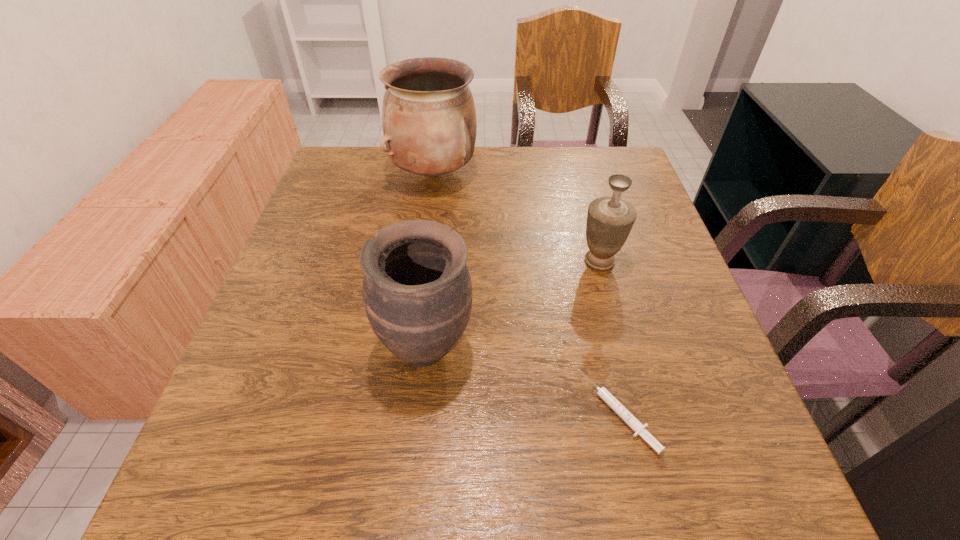
Identify which urn is located as the second nearest to the nearest urn. Please provide its 2D coordinates. Your answer should be formatted as a tuple, i.e. [(x, y)], where the tuple contains the x and y coordinates of a point satisfying the conditions above.

[(429, 122)]

Identify the location of urn that can be found as the closest to the rightmost urn. (417, 291).

You are a GUI agent. You are given a task and a screenshot of the screen. Output one action in this format:
    pyautogui.click(x=<x>, y=<y>)
    Task: Click on the vacant area in the image that satisfies the following two spatial constraints: 1. on the front side of the farthest object; 2. on the right side of the rightmost urn
    
    Given the screenshot: What is the action you would take?
    [423, 261]

Where is `free space that satisfies the following two spatial constraints: 1. on the front side of the syringe; 2. on the left side of the nearest urn`? The width and height of the screenshot is (960, 540). free space that satisfies the following two spatial constraints: 1. on the front side of the syringe; 2. on the left side of the nearest urn is located at coordinates (420, 412).

You are a GUI agent. You are given a task and a screenshot of the screen. Output one action in this format:
    pyautogui.click(x=<x>, y=<y>)
    Task: Click on the free space in the image that satisfies the following two spatial constraints: 1. on the back side of the third tallest object; 2. on the left side of the nearest urn
    
    Given the screenshot: What is the action you would take?
    pyautogui.click(x=435, y=261)

Find the location of a particular element. This screenshot has height=540, width=960. free space that satisfies the following two spatial constraints: 1. on the front side of the nearest urn; 2. on the left side of the farthest object is located at coordinates (412, 348).